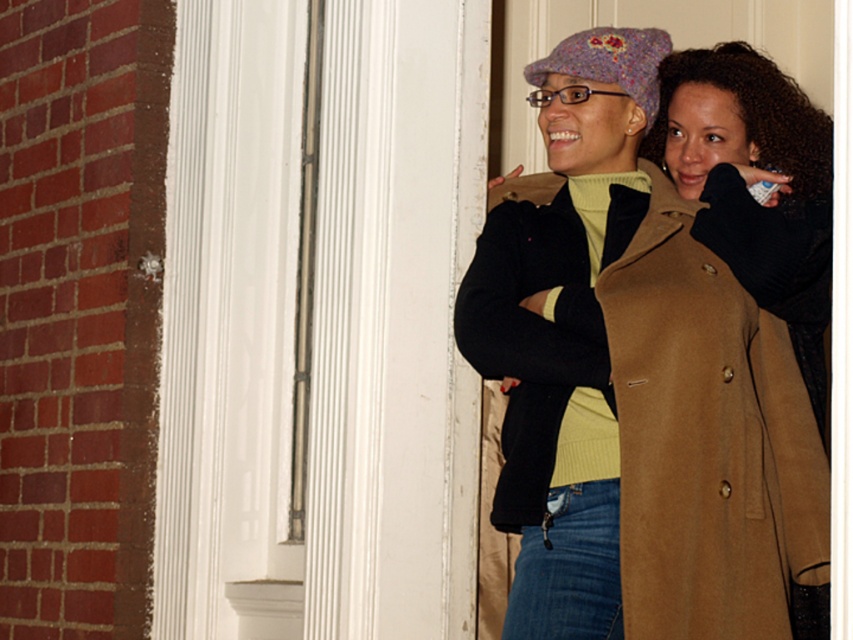
Question: Estimate the real-world distances between objects in this image. Which object is farther from the curly brown hair at upper right?

Choices:
 (A) brown woolen coat at center
 (B) denim at lower right

Answer: (B)

Question: Observing the image, what is the correct spatial positioning of tan woolen trench coat at center in reference to brown woolen coat at center?

Choices:
 (A) below
 (B) above

Answer: (A)

Question: Which point is farther to the camera?

Choices:
 (A) denim at lower right
 (B) tan woolen trench coat at center
 (C) curly brown hair at upper right

Answer: (C)

Question: Can you confirm if tan woolen trench coat at center is positioned above brown woolen coat at center?

Choices:
 (A) yes
 (B) no

Answer: (B)

Question: Among these points, which one is farthest from the camera?

Choices:
 (A) (570, 636)
 (B) (665, 83)

Answer: (B)

Question: Is brown woolen coat at center thinner than denim at lower right?

Choices:
 (A) yes
 (B) no

Answer: (B)